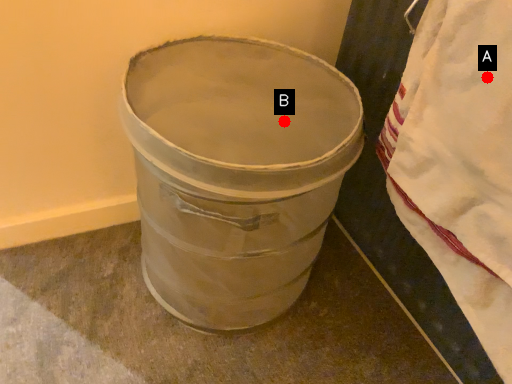
Question: Two points are circled on the image, labeled by A and B beside each circle. Which point appears closest to the camera in this image?

Choices:
 (A) A is closer
 (B) B is closer

Answer: (A)